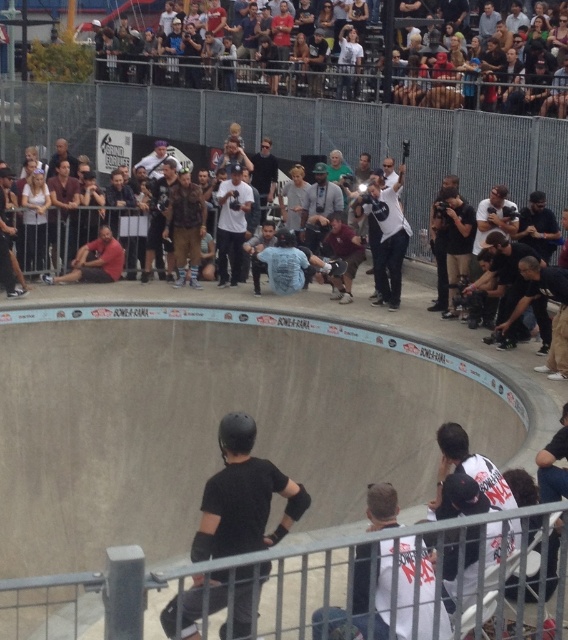
You are a photographer at the skateboarding event. You want to capture a closeup shot of the matte black helmet at center and the black matte skateboard at center. Which object should you zoom in on to ensure it fits entirely within your frame if the frame can only accommodate the narrower of the two?

The black matte skateboard at center is narrower than the matte black helmet at center, so you should zoom in on the black matte skateboard at center to ensure it fits entirely within your frame.

You are a photographer positioned at the edge of the smooth concrete bowl at center. You need to capture a closeup shot of the metallic silver skateboard at center. Given that your camera has a minimum focusing distance of 5 meters, will you be able to take the photo without moving closer?

The distance between the smooth concrete bowl at center and the metallic silver skateboard at center is 8.17 meters. Since your camera can focus as close as 5 meters, you are 3.17 meters beyond the minimum required distance. Therefore, you can take the closeup shot without moving closer.

You are a photographer positioned at the edge of the skate bowl, aiming to capture a clear shot of both the matte black helmet at center and the black matte skateboard at center. Which object should you focus on first to ensure both are in sharp focus?

You should focus on the matte black helmet at center first because it is closer to you than the black matte skateboard at center, ensuring both will be in focus when you adjust the focus between them.